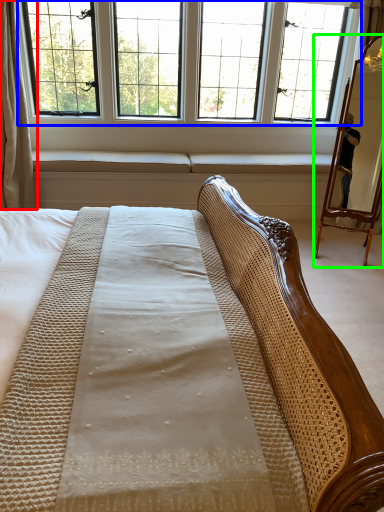
Question: Which object is the closest to the curtain (highlighted by a red box)? Choose among these: window (highlighted by a blue box) or mirror (highlighted by a green box).

Choices:
 (A) window
 (B) mirror

Answer: (A)